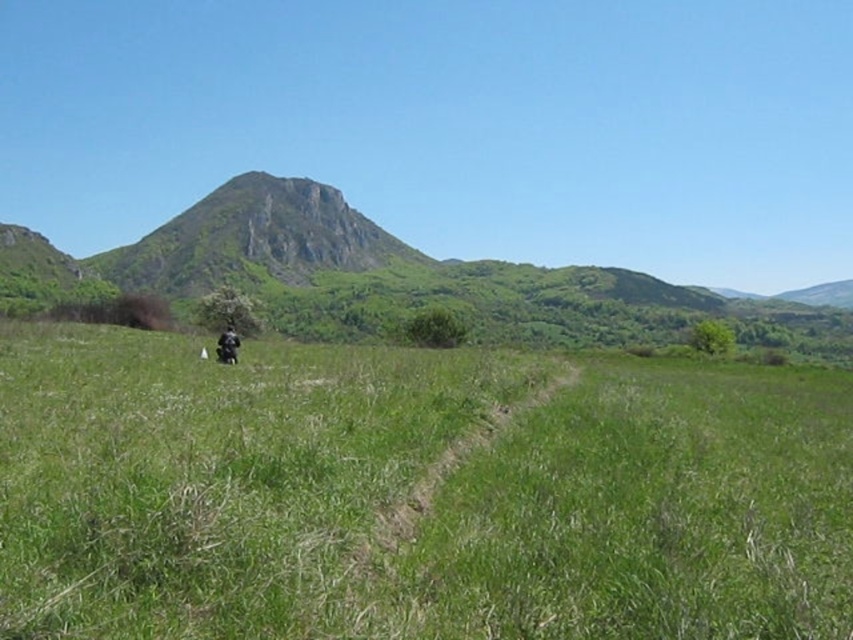
Question: Can you confirm if green grassy field at center is wider than black matte motorcycle at center?

Choices:
 (A) no
 (B) yes

Answer: (B)

Question: Among these points, which one is farthest from the camera?

Choices:
 (A) (178, 349)
 (B) (221, 360)

Answer: (A)

Question: Which of the following is the farthest from the observer?

Choices:
 (A) black matte motorcycle at center
 (B) green grassy field at center

Answer: (A)

Question: Can you confirm if green grassy field at center is positioned to the left of black matte motorcycle at center?

Choices:
 (A) no
 (B) yes

Answer: (A)

Question: Which of the following is the closest to the observer?

Choices:
 (A) (151, 529)
 (B) (219, 348)

Answer: (A)

Question: Can you confirm if green grassy field at center is positioned to the right of black matte motorcycle at center?

Choices:
 (A) yes
 (B) no

Answer: (A)